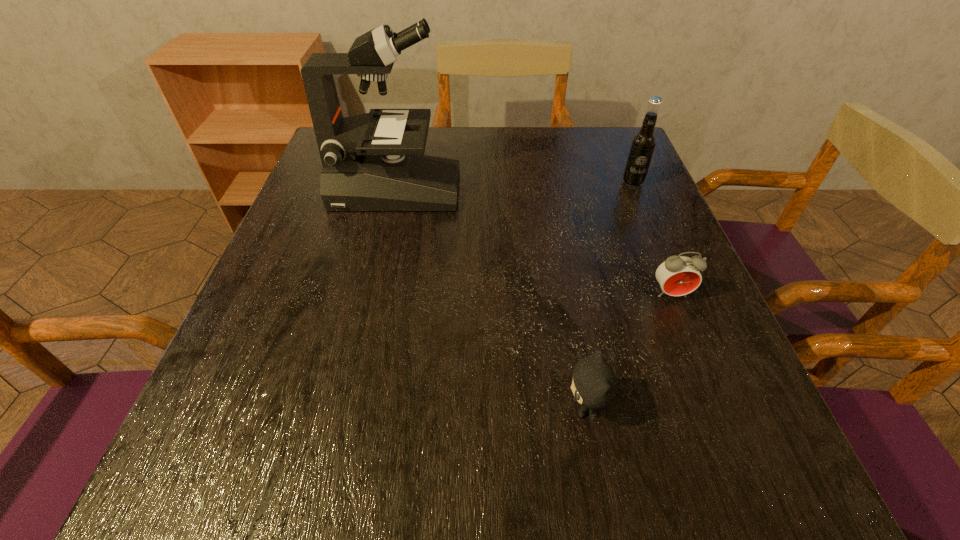
Locate an element on the screen. The height and width of the screenshot is (540, 960). vacant space that satisfies the following two spatial constraints: 1. on the face of the alarm clock; 2. on the front-facing side of the kitten is located at coordinates (716, 408).